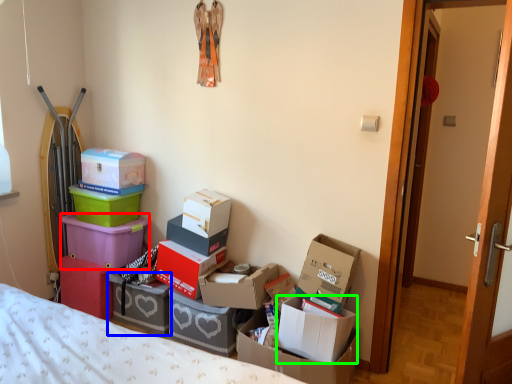
Question: Considering the real-world distances, which object is closest to box (highlighted by a red box)? box (highlighted by a blue box) or box (highlighted by a green box).

Choices:
 (A) box
 (B) box

Answer: (A)